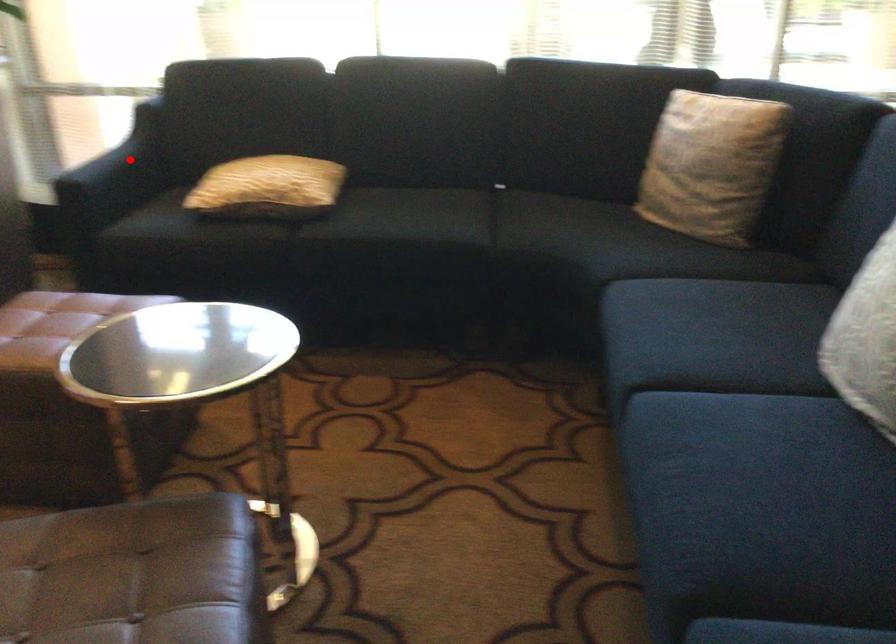
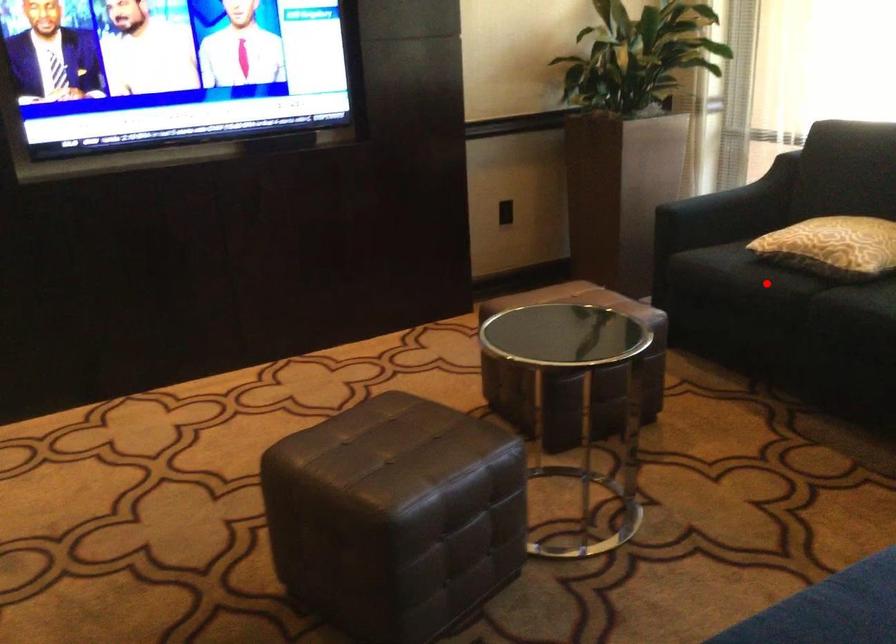
I am providing you with two images of the same scene from different viewpoints. A red point is marked on the first image and another point is marked on the second image. Does the point marked in image1 correspond to the same location as the one in image2?

No